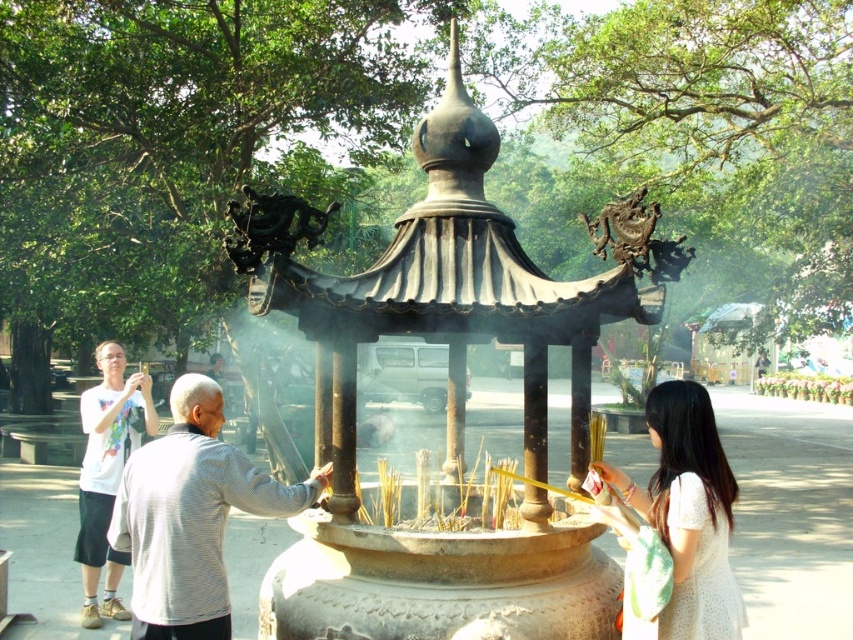
Measure the distance between gray striped shirt at center and white lace dress at lower right.

A distance of 9.71 feet exists between gray striped shirt at center and white lace dress at lower right.

Which of these two, gray striped shirt at center or white lace dress at lower right, stands taller?

With more height is gray striped shirt at center.

Is point (195, 490) positioned in front of point (654, 390)?

Yes, point (195, 490) is in front of point (654, 390).

What are the coordinates of `gray striped shirt at center` in the screenshot? It's located at (190, 515).

Looking at this image, is bronze/golden incense burner at center positioned behind white lace dress at lower right?

Yes, bronze/golden incense burner at center is further from the viewer.

Describe the element at coordinates (447, 396) in the screenshot. I see `bronze/golden incense burner at center` at that location.

Is point (525, 314) more distant than point (676, 548)?

Yes, point (525, 314) is behind point (676, 548).

Locate an element on the screen. This screenshot has width=853, height=640. bronze/golden incense burner at center is located at coordinates (447, 396).

Between bronze/golden incense burner at center and white cotton shirt at left, which one has more height?

bronze/golden incense burner at center

Is bronze/golden incense burner at center smaller than white cotton shirt at left?

No.

Who is more forward, (456, 557) or (93, 625)?

Positioned in front is point (456, 557).

I want to click on bronze/golden incense burner at center, so click(x=447, y=396).